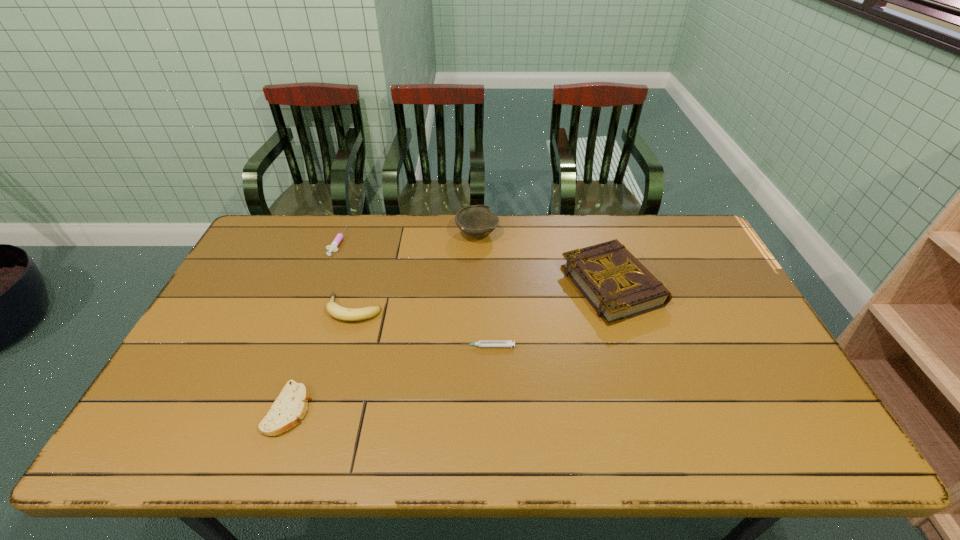
This screenshot has height=540, width=960. What are the coordinates of `vacant space located on the back of the banana` in the screenshot? It's located at (375, 235).

Locate an element on the screen. Image resolution: width=960 pixels, height=540 pixels. vacant area situated on the front of the left syringe is located at coordinates (327, 267).

Identify the location of vacant space located at the needle end of the right syringe. This screenshot has height=540, width=960. (435, 346).

Locate an element on the screen. This screenshot has height=540, width=960. free region located 0.290m at the needle end of the right syringe is located at coordinates (355, 346).

I want to click on vacant space positioned at the needle end of the right syringe, so click(x=319, y=346).

Where is `vacant space located on the right of the pita bread`? The image size is (960, 540). vacant space located on the right of the pita bread is located at coordinates (445, 409).

The width and height of the screenshot is (960, 540). I want to click on bowl situated at the far edge, so click(x=476, y=221).

Where is `hardback book located at the far edge`? Image resolution: width=960 pixels, height=540 pixels. hardback book located at the far edge is located at coordinates (618, 287).

The width and height of the screenshot is (960, 540). In order to click on syringe at the far edge in this screenshot , I will do `click(333, 246)`.

This screenshot has width=960, height=540. I want to click on object present at the near edge, so click(x=290, y=406).